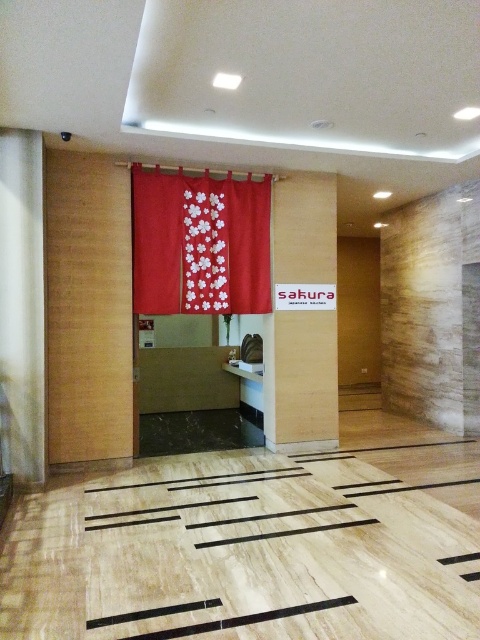
Question: Can you confirm if red floral fabric curtain at center is wider than wooden sign at center?

Choices:
 (A) no
 (B) yes

Answer: (B)

Question: Is red floral fabric curtain at center to the right of wooden sign at center from the viewer's perspective?

Choices:
 (A) no
 (B) yes

Answer: (A)

Question: Among these objects, which one is farthest from the camera?

Choices:
 (A) wooden sign at center
 (B) red floral fabric curtain at center

Answer: (A)

Question: Is red floral fabric curtain at center positioned behind wooden sign at center?

Choices:
 (A) no
 (B) yes

Answer: (A)

Question: Among these objects, which one is farthest from the camera?

Choices:
 (A) wooden sign at center
 (B) red floral fabric curtain at center

Answer: (A)